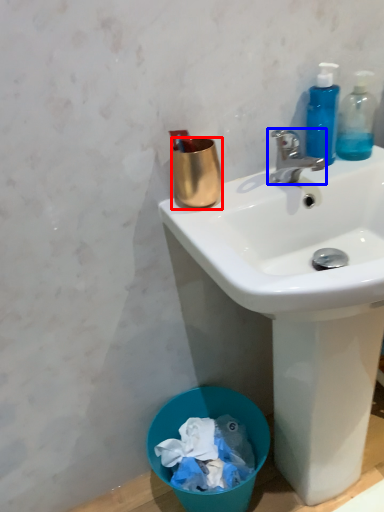
Question: Which point is further to the camera, coffee cup (highlighted by a red box) or faucet (highlighted by a blue box)?

Choices:
 (A) coffee cup
 (B) faucet

Answer: (A)